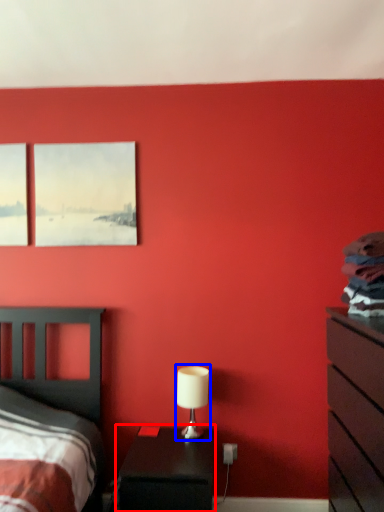
Question: Which point is further to the camera, nightstand (highlighted by a red box) or table lamp (highlighted by a blue box)?

Choices:
 (A) nightstand
 (B) table lamp

Answer: (B)